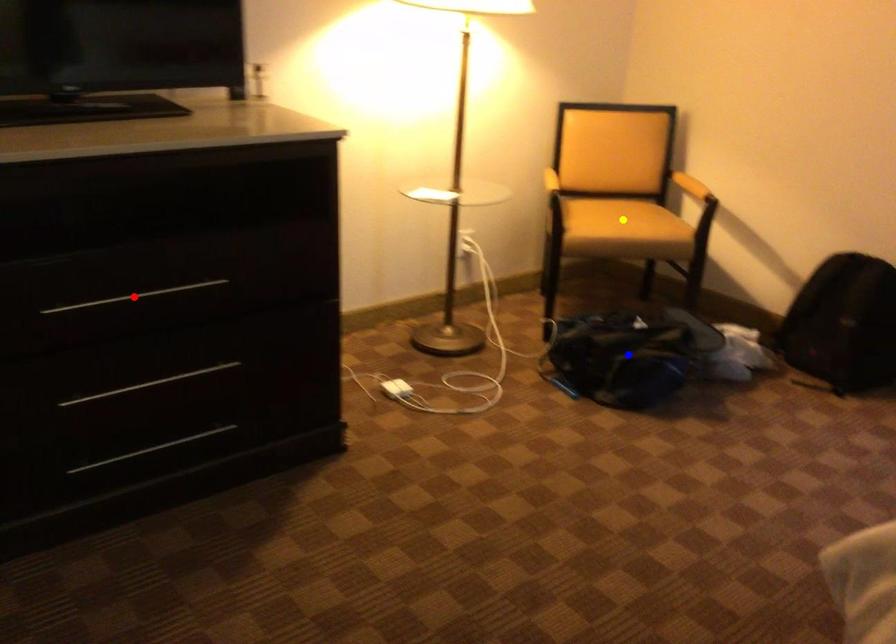
In the scene shown: Order these from farthest to nearest:
blue point | red point | yellow point

1. yellow point
2. blue point
3. red point